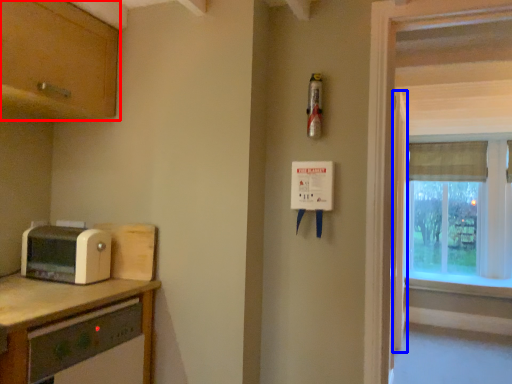
Question: Which of the following is the closest to the observer, cabinetry (highlighted by a red box) or screen door (highlighted by a blue box)?

Choices:
 (A) cabinetry
 (B) screen door

Answer: (A)